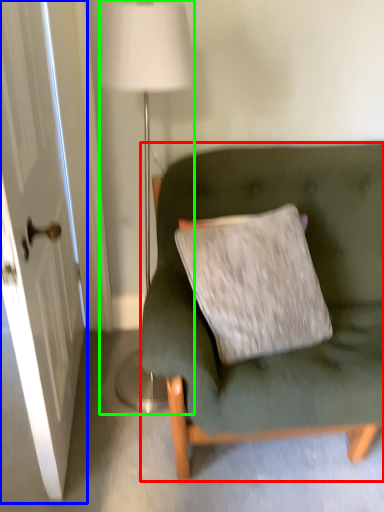
Question: Estimate the real-world distances between objects in this image. Which object is closer to studio couch (highlighted by a red box), door (highlighted by a blue box) or lamp (highlighted by a green box)?

Choices:
 (A) door
 (B) lamp

Answer: (A)